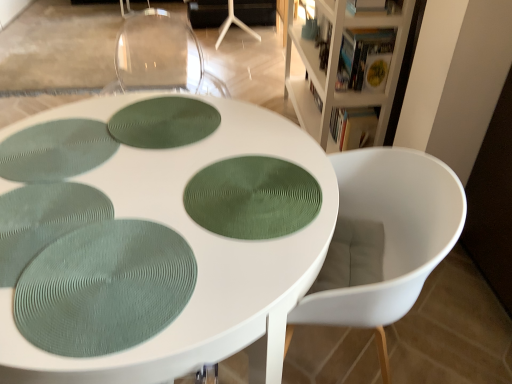
Where is `free space above green textured placemat at center, positioned as the second oval in bottom-to-top order (from a real-world perspective)`? This screenshot has width=512, height=384. free space above green textured placemat at center, positioned as the second oval in bottom-to-top order (from a real-world perspective) is located at coordinates (246, 195).